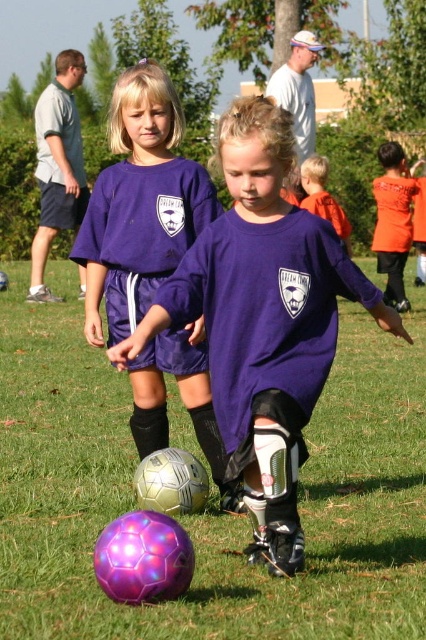
Question: Does green grass at center appear on the left side of light gray shirt at upper left?

Choices:
 (A) yes
 (B) no

Answer: (B)

Question: Which is farther from the orange fabric shirt at upper right?

Choices:
 (A) orange matte shirt at upper right
 (B) purple matte shorts at lower left
 (C) light gray shirt at upper left
 (D) green grass at center

Answer: (D)

Question: Which point is closer to the camera taking this photo?

Choices:
 (A) (394, 220)
 (B) (313, 189)
 (C) (127, 301)
 (D) (72, 157)

Answer: (C)

Question: Is orange fabric shirt at upper right further to camera compared to orange matte shirt at upper right?

Choices:
 (A) yes
 (B) no

Answer: (A)

Question: Can you confirm if purple matte shorts at lower left is positioned to the left of orange matte shirt at upper right?

Choices:
 (A) yes
 (B) no

Answer: (A)

Question: Among these objects, which one is farthest from the camera?

Choices:
 (A) purple matte soccer ball at lower left
 (B) green grass at center

Answer: (B)